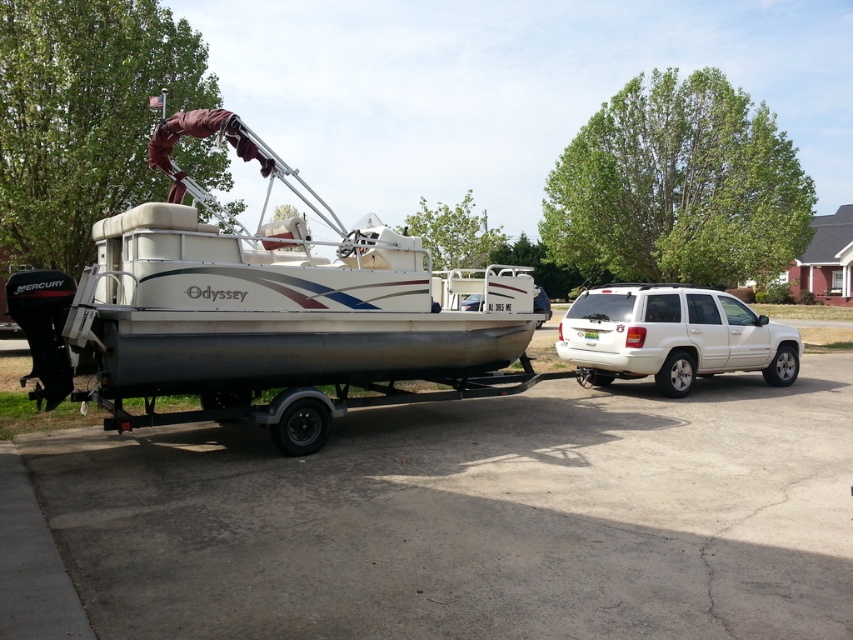
Question: Which point appears farthest from the camera in this image?

Choices:
 (A) tap(468, 294)
 (B) tap(192, 356)

Answer: (A)

Question: Which point is farther to the camera?

Choices:
 (A) white matte suv at right
 (B) white matte boat at center
 (C) silver metallic pontoon boat at left

Answer: (A)

Question: Which of the following is the farthest from the observer?

Choices:
 (A) (537, 326)
 (B) (250, 401)

Answer: (A)

Question: Does white matte suv at right have a smaller size compared to white matte boat at center?

Choices:
 (A) no
 (B) yes

Answer: (B)

Question: Can you confirm if silver metallic pontoon boat at left is wider than white matte suv at right?

Choices:
 (A) no
 (B) yes

Answer: (A)

Question: Can you confirm if silver metallic pontoon boat at left is positioned below white matte suv at right?

Choices:
 (A) no
 (B) yes

Answer: (A)